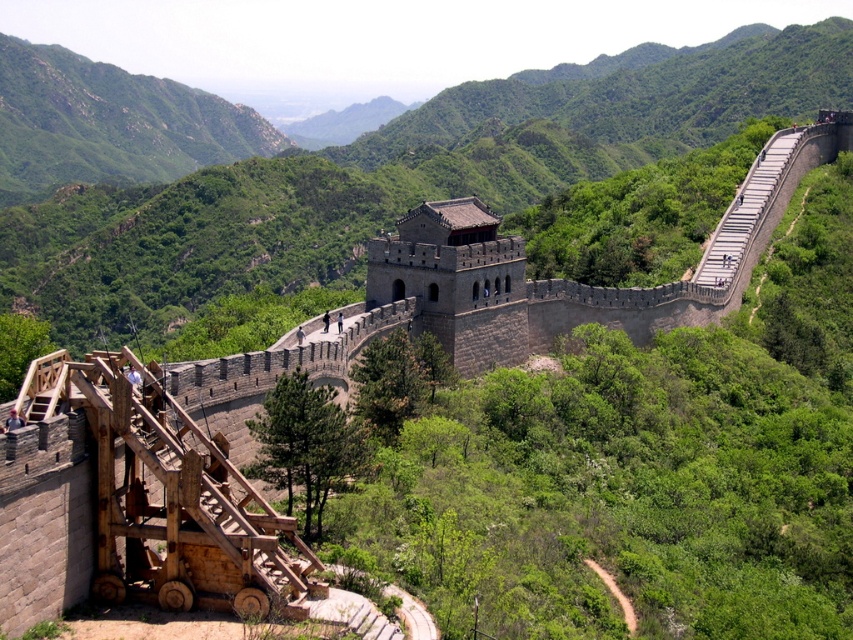
Question: Is wooden staircase at lower left below gray stone staircase at upper right?

Choices:
 (A) no
 (B) yes

Answer: (B)

Question: Which point is farther from the camera taking this photo?

Choices:
 (A) (198, 444)
 (B) (704, 252)

Answer: (B)

Question: Is wooden staircase at lower left bigger than gray stone staircase at upper right?

Choices:
 (A) no
 (B) yes

Answer: (A)

Question: Which of the following is the farthest from the observer?

Choices:
 (A) (700, 259)
 (B) (155, 449)

Answer: (A)

Question: Which of the following is the closest to the observer?

Choices:
 (A) gray stone staircase at upper right
 (B) wooden staircase at lower left

Answer: (B)

Question: Is wooden staircase at lower left to the left of gray stone staircase at upper right from the viewer's perspective?

Choices:
 (A) no
 (B) yes

Answer: (B)